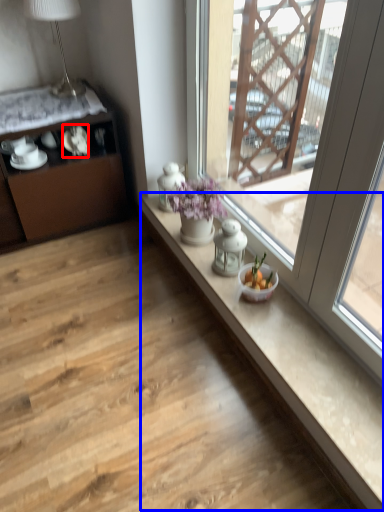
Question: Which object is further to the camera taking this photo, tableware (highlighted by a red box) or counter top (highlighted by a blue box)?

Choices:
 (A) tableware
 (B) counter top

Answer: (A)